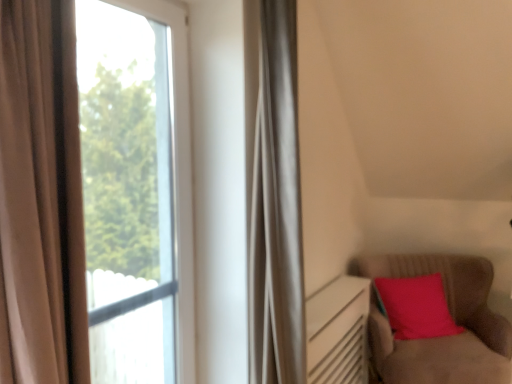
Question: From a real-world perspective, is transparent glass window at left, which ranks as the 1th window in right-to-left order, on top of velvet-like brown armchair at lower right?

Choices:
 (A) yes
 (B) no

Answer: (A)

Question: Is transparent glass window at left, which ranks as the 1th window in right-to-left order, to the right of velvet-like brown armchair at lower right from the viewer's perspective?

Choices:
 (A) no
 (B) yes

Answer: (A)

Question: Does transparent glass window at left, which ranks as the 1th window in right-to-left order, have a lesser width compared to velvet-like brown armchair at lower right?

Choices:
 (A) no
 (B) yes

Answer: (B)

Question: Is velvet-like brown armchair at lower right surrounded by transparent glass window at left, which ranks as the 1th window in right-to-left order?

Choices:
 (A) no
 (B) yes

Answer: (A)

Question: Is transparent glass window at left, the 2th window in the left-to-right sequence, taller than velvet-like brown armchair at lower right?

Choices:
 (A) yes
 (B) no

Answer: (A)

Question: Is the depth of transparent glass window at left, which ranks as the 1th window in right-to-left order, greater than that of velvet-like brown armchair at lower right?

Choices:
 (A) no
 (B) yes

Answer: (A)

Question: From the image's perspective, is velvet-like brown armchair at lower right under transparent glass window at left, the 1th window positioned from the left?

Choices:
 (A) no
 (B) yes

Answer: (B)

Question: Considering the relative positions of velvet-like brown armchair at lower right and transparent glass window at left, the 1th window positioned from the left, in the image provided, is velvet-like brown armchair at lower right to the right of transparent glass window at left, the 1th window positioned from the left, from the viewer's perspective?

Choices:
 (A) yes
 (B) no

Answer: (A)

Question: From the image's perspective, does velvet-like brown armchair at lower right appear higher than transparent glass window at left, the 1th window positioned from the left?

Choices:
 (A) no
 (B) yes

Answer: (A)

Question: Considering the relative sizes of velvet-like brown armchair at lower right and transparent glass window at left, the 1th window positioned from the left, in the image provided, is velvet-like brown armchair at lower right bigger than transparent glass window at left, the 1th window positioned from the left,?

Choices:
 (A) yes
 (B) no

Answer: (A)

Question: Is velvet-like brown armchair at lower right shorter than transparent glass window at left, arranged as the 2th window when viewed from the right?

Choices:
 (A) yes
 (B) no

Answer: (A)

Question: Does velvet-like brown armchair at lower right have a lesser width compared to transparent glass window at left, the 1th window positioned from the left?

Choices:
 (A) no
 (B) yes

Answer: (A)

Question: From the image's perspective, is transparent glass window at left, which ranks as the 1th window in right-to-left order, over transparent glass window at left, the 1th window positioned from the left?

Choices:
 (A) no
 (B) yes

Answer: (B)